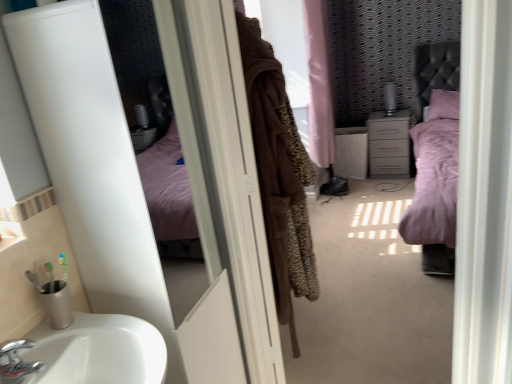
Question: Can you confirm if matte gray chest of drawers at center is smaller than chrome metallic faucet at lower left?

Choices:
 (A) no
 (B) yes

Answer: (A)

Question: Does matte gray chest of drawers at center turn towards chrome metallic faucet at lower left?

Choices:
 (A) yes
 (B) no

Answer: (A)

Question: Is the depth of matte gray chest of drawers at center greater than that of chrome metallic faucet at lower left?

Choices:
 (A) yes
 (B) no

Answer: (A)

Question: From the image's perspective, is matte gray chest of drawers at center located beneath chrome metallic faucet at lower left?

Choices:
 (A) no
 (B) yes

Answer: (A)

Question: Is matte gray chest of drawers at center positioned before chrome metallic faucet at lower left?

Choices:
 (A) no
 (B) yes

Answer: (A)

Question: From a real-world perspective, relative to matte gray chest of drawers at center, is pink plush bed at center vertically above or below?

Choices:
 (A) below
 (B) above

Answer: (B)

Question: Considering the positions of point (445, 94) and point (392, 163), is point (445, 94) closer or farther from the camera than point (392, 163)?

Choices:
 (A) closer
 (B) farther

Answer: (A)

Question: Looking at their shapes, would you say pink plush bed at center is wider or thinner than matte gray chest of drawers at center?

Choices:
 (A) thin
 (B) wide

Answer: (B)

Question: Is pink plush bed at center inside or outside of matte gray chest of drawers at center?

Choices:
 (A) inside
 (B) outside

Answer: (B)

Question: Does point (381, 173) appear closer or farther from the camera than point (421, 216)?

Choices:
 (A) farther
 (B) closer

Answer: (A)

Question: From the image's perspective, relative to pink plush bed at center, is matte gray chest of drawers at center above or below?

Choices:
 (A) above
 (B) below

Answer: (A)

Question: Do you think matte gray chest of drawers at center is within pink plush bed at center, or outside of it?

Choices:
 (A) inside
 (B) outside

Answer: (B)

Question: Looking at their shapes, would you say matte gray chest of drawers at center is wider or thinner than pink plush bed at center?

Choices:
 (A) wide
 (B) thin

Answer: (B)

Question: Considering their positions, is chrome metallic faucet at lower left located in front of or behind white glossy screen door at upper left, which is counted as the second screen door, starting from the right?

Choices:
 (A) front
 (B) behind

Answer: (B)

Question: Would you say chrome metallic faucet at lower left is to the left or to the right of white glossy screen door at upper left, which is the 1th screen door in left-to-right order, in the picture?

Choices:
 (A) left
 (B) right

Answer: (A)